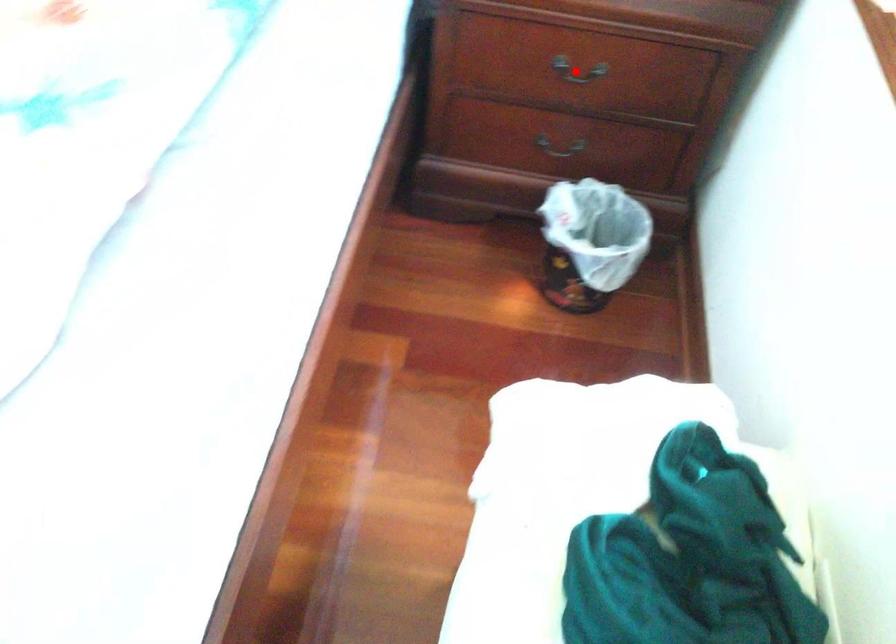
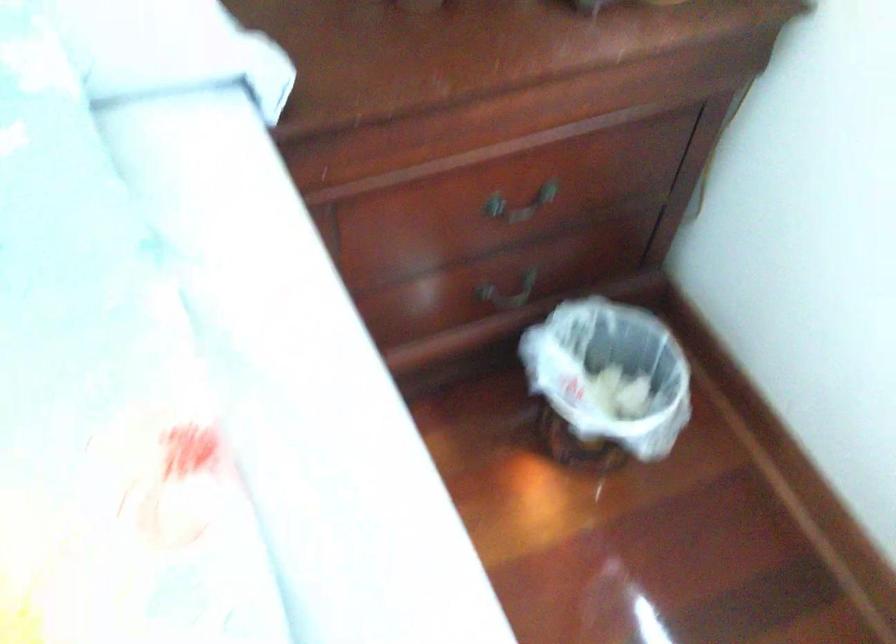
Locate, in the second image, the point that corresponds to the highlighted location in the first image.

(519, 205)